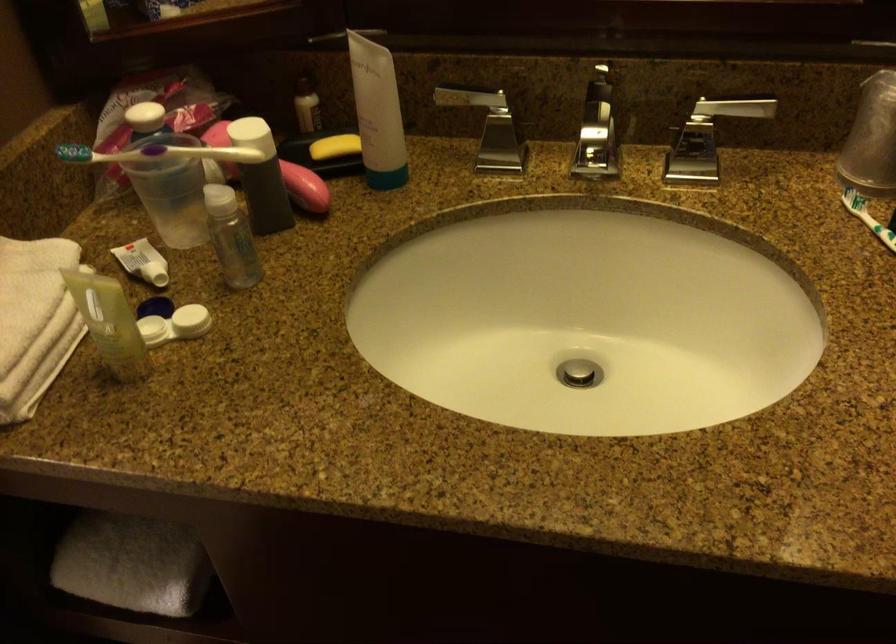
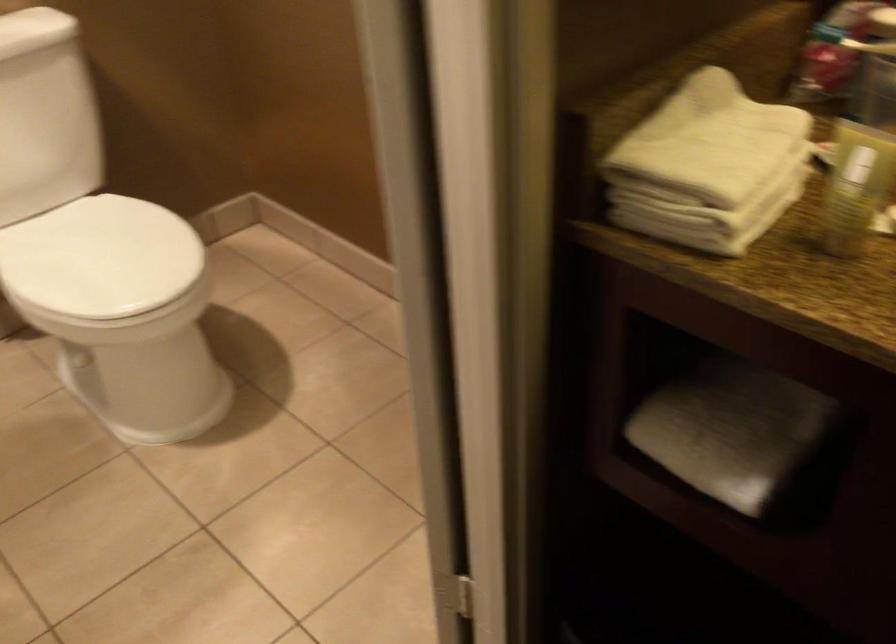
Locate, in the second image, the point that corresponds to [104,337] in the first image.

(849, 204)